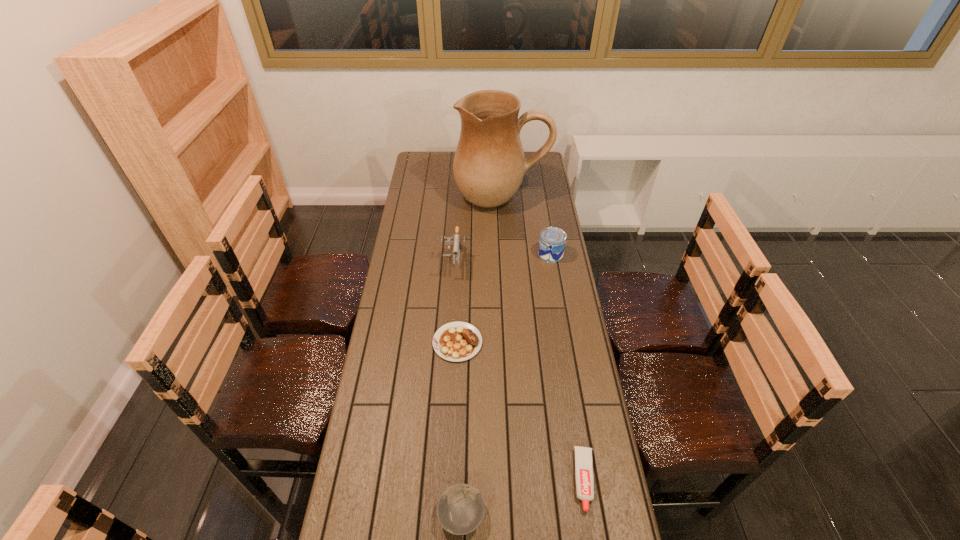
Where is `vacant space that is in between the toothpaste and the fourth farthest object`? This screenshot has height=540, width=960. vacant space that is in between the toothpaste and the fourth farthest object is located at coordinates (521, 411).

At what (x,y) coordinates should I click in order to perform the action: click on free space between the third tallest object and the gun. Please return your answer as a coordinate pair (x, y). The height and width of the screenshot is (540, 960). Looking at the image, I should click on (502, 258).

Find the location of `vacant point located between the toothpaste and the fourth farthest object`. vacant point located between the toothpaste and the fourth farthest object is located at coordinates (521, 411).

Locate an element on the screen. This screenshot has width=960, height=540. empty location between the third tallest object and the farthest object is located at coordinates (526, 226).

At what (x,y) coordinates should I click in order to perform the action: click on free space between the fifth shortest object and the toothpaste. Please return your answer as a coordinate pair (x, y). This screenshot has height=540, width=960. Looking at the image, I should click on (519, 370).

Select which object is the third closest to the can. Please provide its 2D coordinates. Your answer should be formatted as a tuple, i.e. [(x, y)], where the tuple contains the x and y coordinates of a point satisfying the conditions above.

[(458, 341)]

Identify the location of the closest object relative to the third nearest object. (457, 238).

Locate an element on the screen. free region that satisfies the following two spatial constraints: 1. on the front side of the toothpaste; 2. on the right side of the steak is located at coordinates (451, 480).

The height and width of the screenshot is (540, 960). Find the location of `vacant point that satisfies the following two spatial constraints: 1. on the front label of the fourth shortest object; 2. at the barrel end of the gun`. vacant point that satisfies the following two spatial constraints: 1. on the front label of the fourth shortest object; 2. at the barrel end of the gun is located at coordinates point(552,261).

This screenshot has width=960, height=540. What are the coordinates of `free spot that satisfies the following two spatial constraints: 1. on the front label of the third tallest object; 2. at the barrel end of the gun` in the screenshot? It's located at (552, 261).